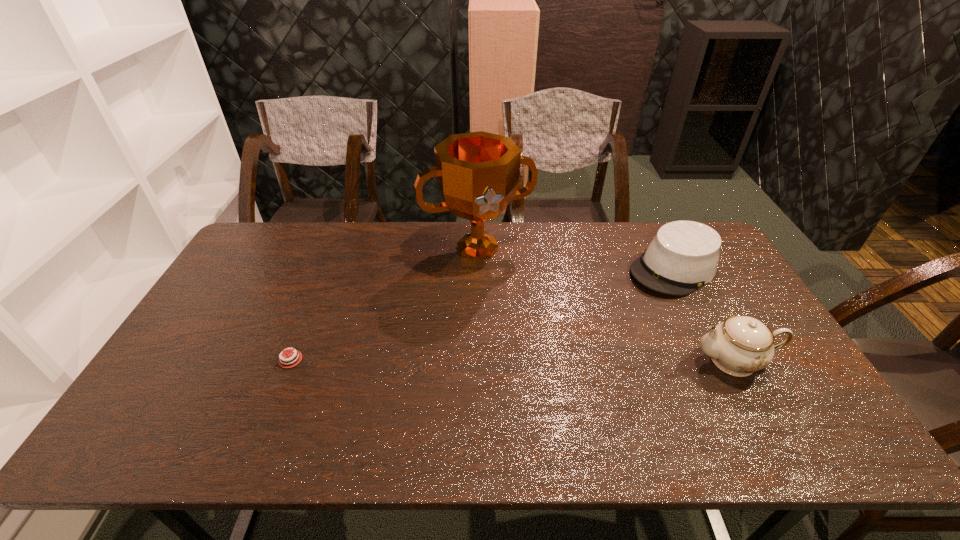
At what (x,y) coordinates should I click in order to perform the action: click on free space on the desktop that is between the chocolate cake and the chinaware and is positioned on the front-facing side of the hat. Please return your answer as a coordinate pair (x, y). Looking at the image, I should click on (542, 360).

Find the location of a particular element. free space on the desktop that is between the leftmost object and the chinaware and is positioned on the side of the tallest object with the star emblem is located at coordinates (533, 360).